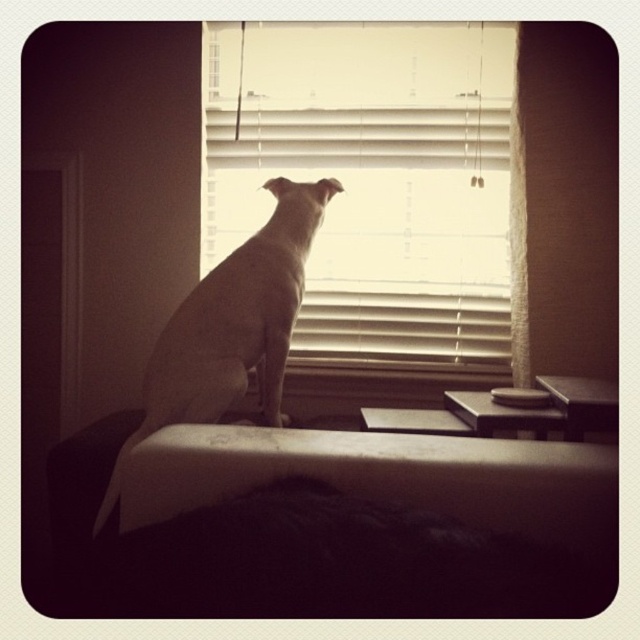
Question: Is the position of white blinds at center more distant than that of white smooth dog at center?

Choices:
 (A) no
 (B) yes

Answer: (B)

Question: Is white blinds at center to the right of white smooth dog at center from the viewer's perspective?

Choices:
 (A) no
 (B) yes

Answer: (B)

Question: Can you confirm if white blinds at center is positioned to the right of white fabric bed at center?

Choices:
 (A) yes
 (B) no

Answer: (A)

Question: Which point is farther to the camera?

Choices:
 (A) white fabric bed at center
 (B) white blinds at center
 (C) white smooth dog at center

Answer: (B)

Question: Which point is closer to the camera taking this photo?

Choices:
 (A) (266, 492)
 (B) (214, 51)

Answer: (A)

Question: Which of the following is the closest to the observer?

Choices:
 (A) (396, 184)
 (B) (264, 259)

Answer: (B)